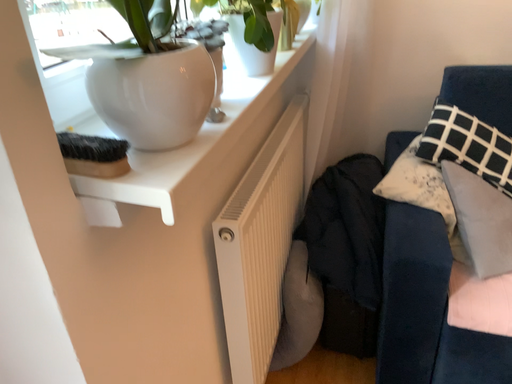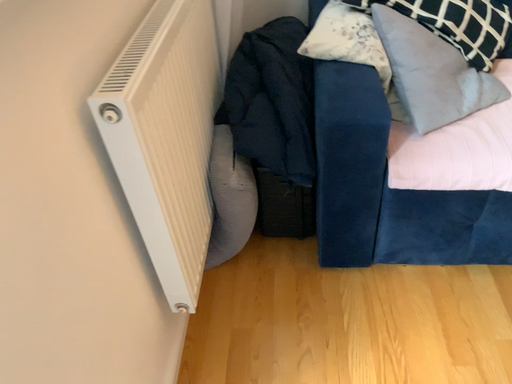
Question: How did the camera likely rotate when shooting the video?

Choices:
 (A) rotated downward
 (B) rotated upward

Answer: (A)